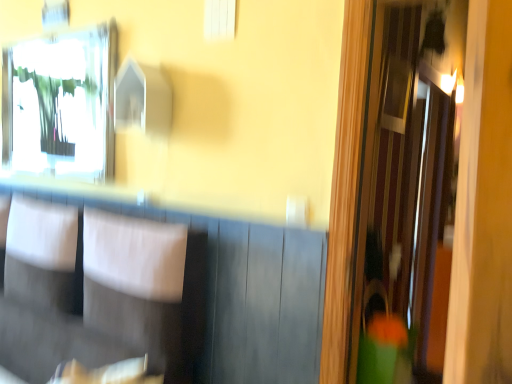
Question: Is clear glass mirror at upper left taller or shorter than white fabric armchair at center?

Choices:
 (A) tall
 (B) short

Answer: (A)

Question: Looking at their shapes, would you say clear glass mirror at upper left is wider or thinner than white fabric armchair at center?

Choices:
 (A) wide
 (B) thin

Answer: (B)

Question: Visually, is clear glass mirror at upper left positioned to the left or to the right of white fabric armchair at center?

Choices:
 (A) left
 (B) right

Answer: (A)

Question: Is white fabric armchair at center inside the boundaries of clear glass mirror at upper left, or outside?

Choices:
 (A) outside
 (B) inside

Answer: (A)

Question: From a real-world perspective, relative to clear glass mirror at upper left, is white fabric armchair at center vertically above or below?

Choices:
 (A) above
 (B) below

Answer: (B)

Question: In terms of height, does white fabric armchair at center look taller or shorter compared to clear glass mirror at upper left?

Choices:
 (A) short
 (B) tall

Answer: (A)

Question: Considering the positions of white fabric armchair at center and clear glass mirror at upper left in the image, is white fabric armchair at center wider or thinner than clear glass mirror at upper left?

Choices:
 (A) wide
 (B) thin

Answer: (A)